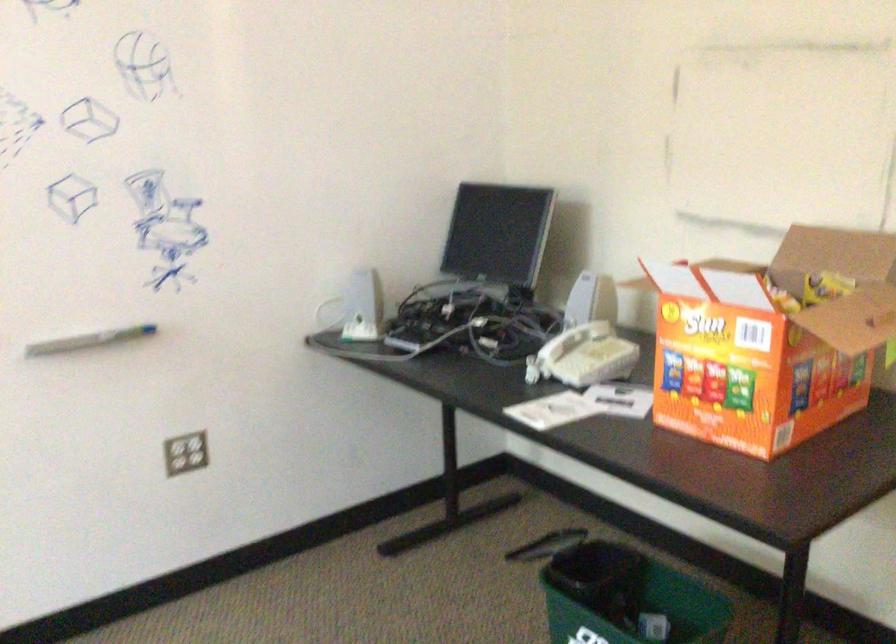
Where would you grasp the whiteboard marker? Please return your answer as a coordinate pair (x, y).

(88, 339)